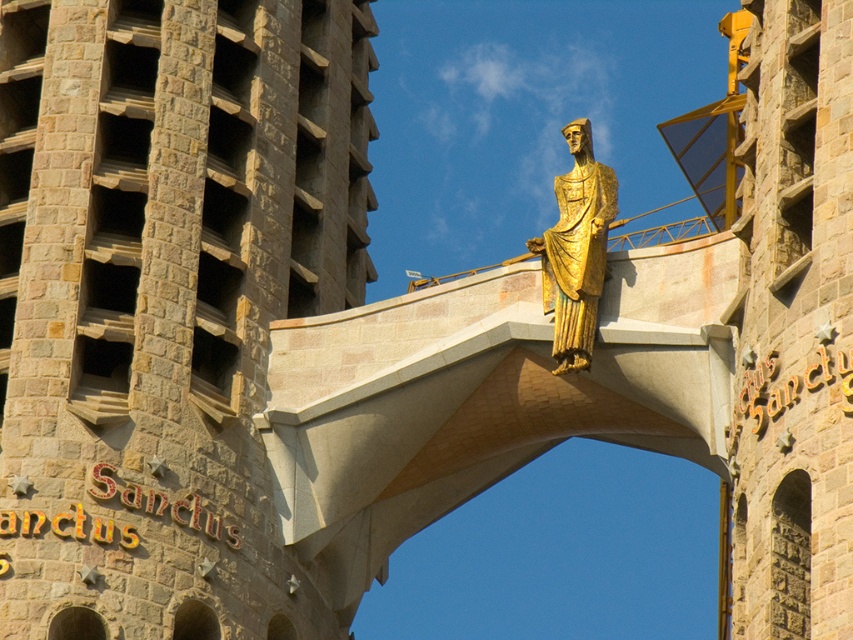
Between point (262, 499) and point (593, 316), which one is positioned in front?

Point (593, 316) is in front.

Can you confirm if beige stone tower at center is positioned to the left of gold polished statue at upper center?

Indeed, beige stone tower at center is positioned on the left side of gold polished statue at upper center.

Locate an element on the screen. This screenshot has height=640, width=853. beige stone tower at center is located at coordinates (165, 298).

Locate an element on the screen. beige stone tower at center is located at coordinates (165, 298).